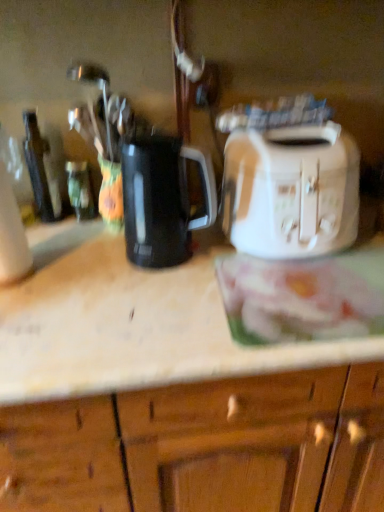
The width and height of the screenshot is (384, 512). I want to click on free spot above white plastic toaster at right (from a real-world perspective), so (x=282, y=128).